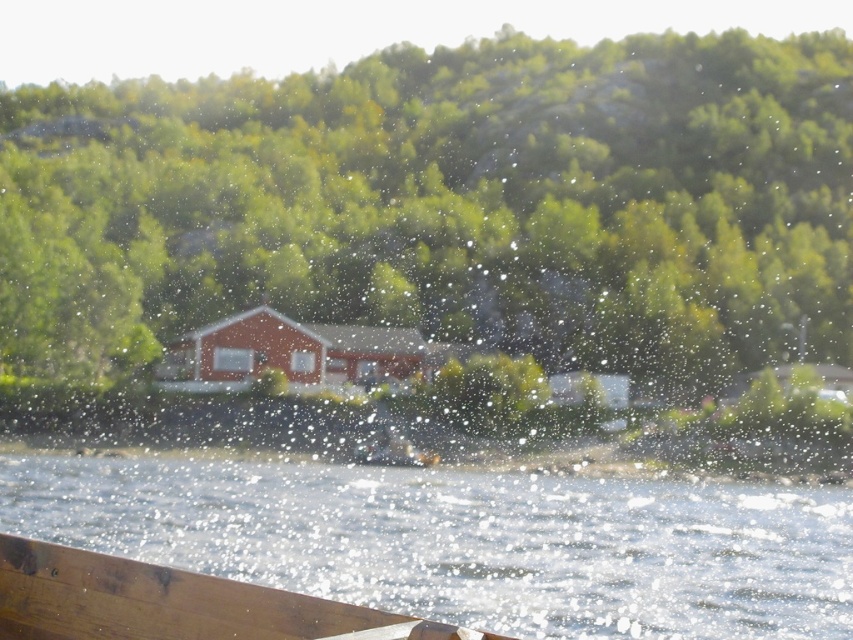
Question: Can you confirm if clear water at lower center is positioned to the right of wooden boat at lower left?

Choices:
 (A) yes
 (B) no

Answer: (A)

Question: Which point is closer to the camera?

Choices:
 (A) clear water at lower center
 (B) wooden boat at lower left

Answer: (B)

Question: Can you confirm if clear water at lower center is positioned to the left of wooden boat at lower left?

Choices:
 (A) no
 (B) yes

Answer: (A)

Question: Is clear water at lower center positioned at the back of wooden boat at lower left?

Choices:
 (A) no
 (B) yes

Answer: (B)

Question: Which point is farther to the camera?

Choices:
 (A) (306, 518)
 (B) (212, 586)

Answer: (A)

Question: Which point is closer to the camera taking this photo?

Choices:
 (A) (602, 621)
 (B) (375, 627)

Answer: (B)